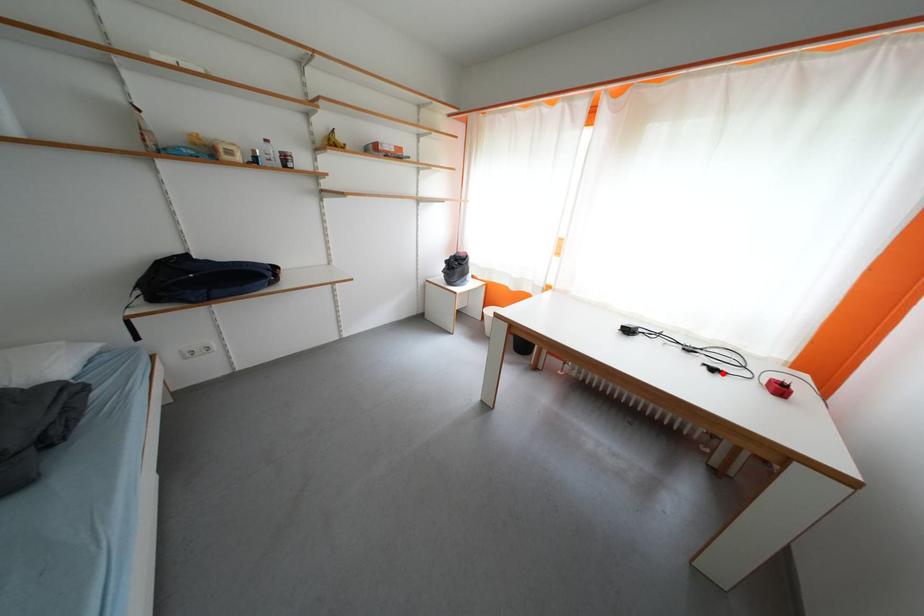
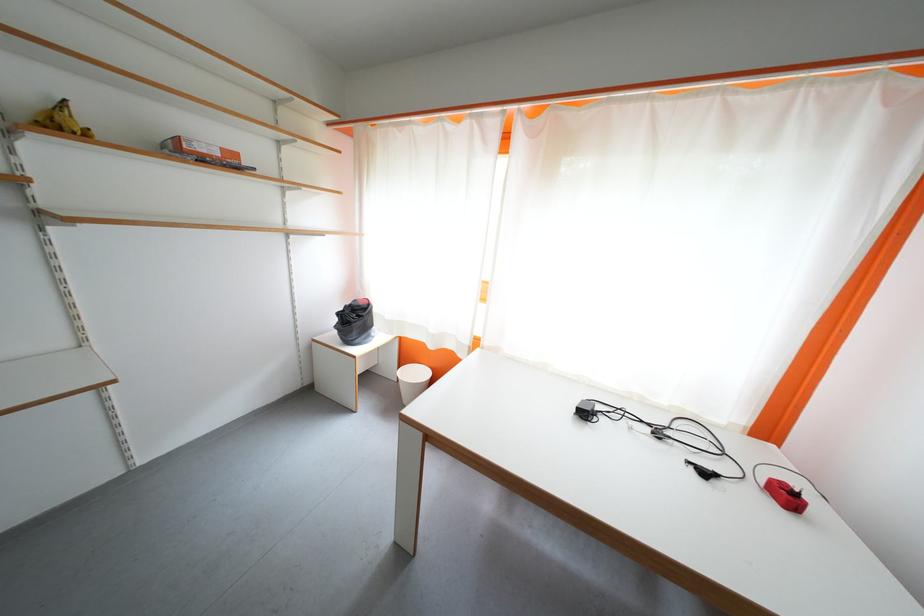
In the second image, find the point that corresponds to the highlighted location in the first image.

(713, 477)